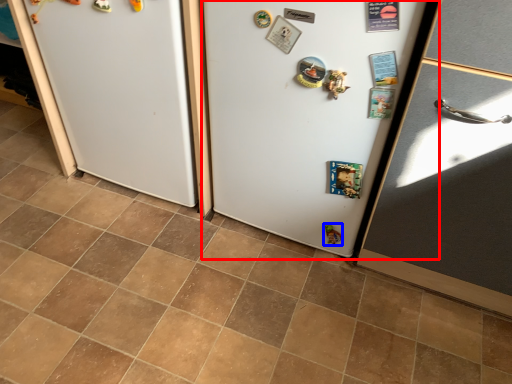
Question: Which object is closer to the camera taking this photo, fridge (highlighted by a red box) or toy (highlighted by a blue box)?

Choices:
 (A) fridge
 (B) toy

Answer: (A)